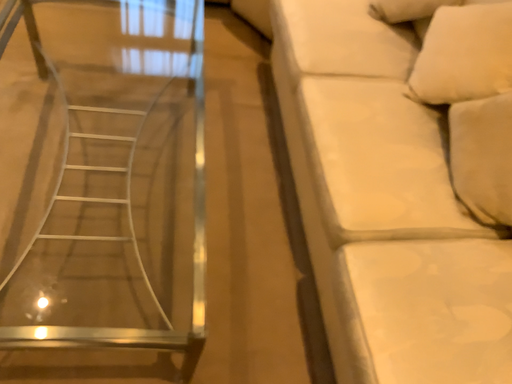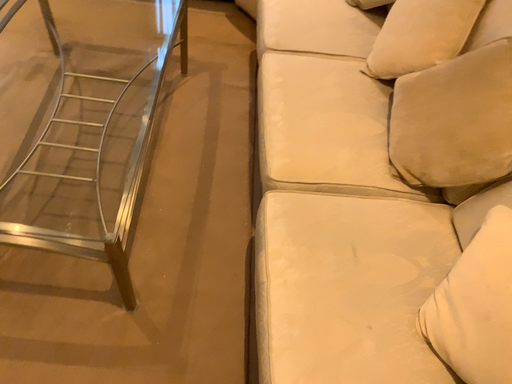
Question: How did the camera likely rotate when shooting the video?

Choices:
 (A) rotated right
 (B) rotated left

Answer: (B)